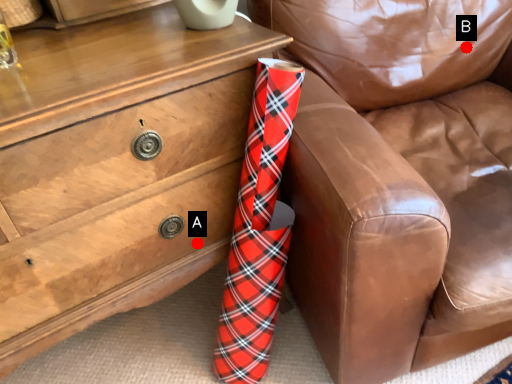
Question: Two points are circled on the image, labeled by A and B beside each circle. Which point is further to the camera?

Choices:
 (A) A is further
 (B) B is further

Answer: (B)